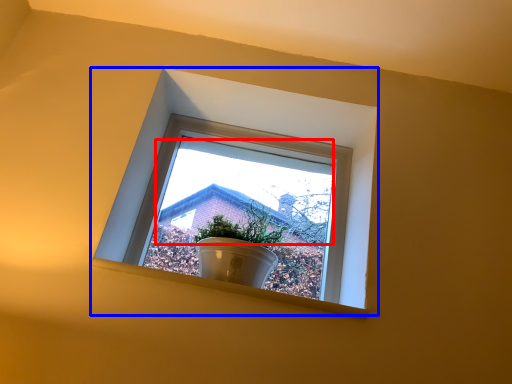
Question: Which object appears farthest to the camera in this image, morning light (highlighted by a red box) or window (highlighted by a blue box)?

Choices:
 (A) morning light
 (B) window

Answer: (B)